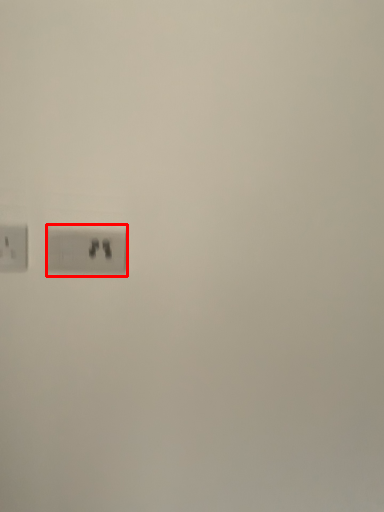
Question: Where is power plugs and sockets (annotated by the red box) located in relation to power plugs and sockets in the image?

Choices:
 (A) left
 (B) right

Answer: (B)